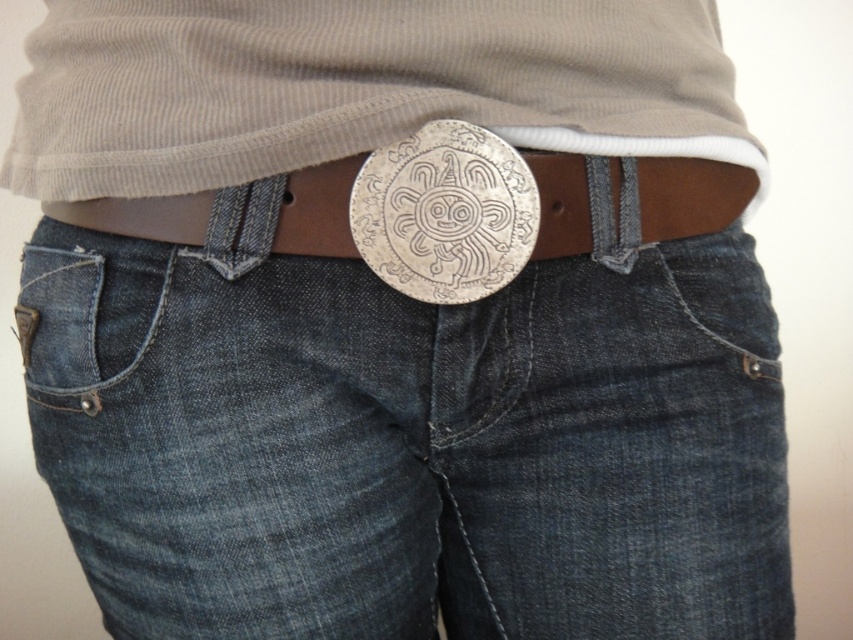
Question: From the image, what is the correct spatial relationship of denim at center in relation to silver metallic buckle at center?

Choices:
 (A) below
 (B) above

Answer: (A)

Question: Can you confirm if denim at center is positioned to the left of silver metallic buckle at center?

Choices:
 (A) no
 (B) yes

Answer: (A)

Question: Which object is farther from the camera taking this photo?

Choices:
 (A) denim at center
 (B) silver metallic buckle at center

Answer: (A)

Question: Is denim at center above silver metallic buckle at center?

Choices:
 (A) yes
 (B) no

Answer: (B)

Question: Which point is farther to the camera?

Choices:
 (A) silver metallic buckle at center
 (B) denim pocket at lower left

Answer: (B)

Question: Which point is farther to the camera?

Choices:
 (A) (148, 344)
 (B) (671, 202)

Answer: (B)